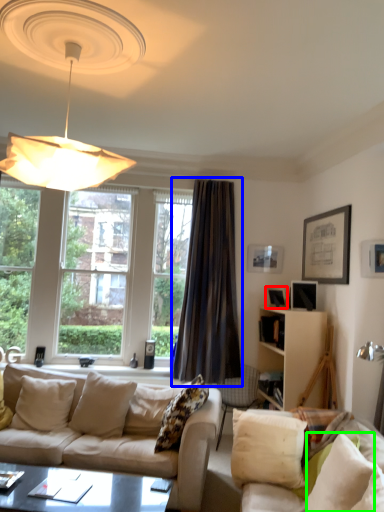
Question: Considering the real-world distances, which object is closest to picture frame (highlighted by a red box)? curtain (highlighted by a blue box) or pillow (highlighted by a green box).

Choices:
 (A) curtain
 (B) pillow

Answer: (A)